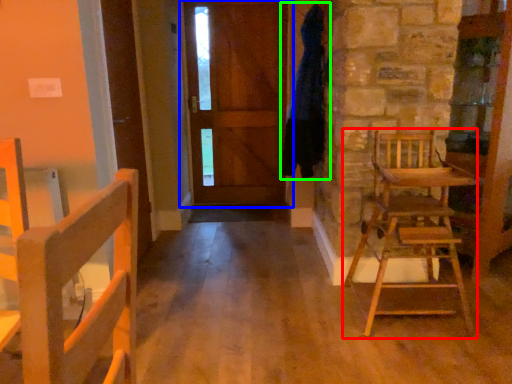
Question: Which is farther away from chair (highlighted by a red box)? door (highlighted by a blue box) or bathrobe (highlighted by a green box)?

Choices:
 (A) door
 (B) bathrobe

Answer: (A)